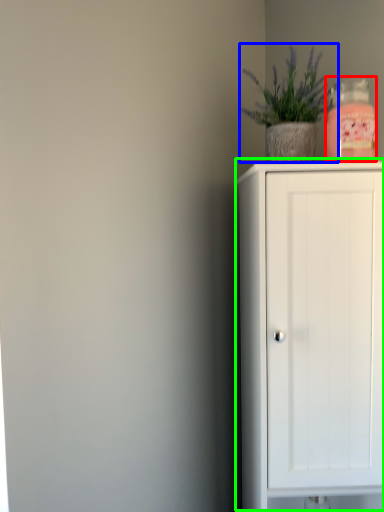
Question: Based on their relative distances, which object is farther from bottle (highlighted by a red box)? Choose from houseplant (highlighted by a blue box) and cupboard (highlighted by a green box).

Choices:
 (A) houseplant
 (B) cupboard

Answer: (B)